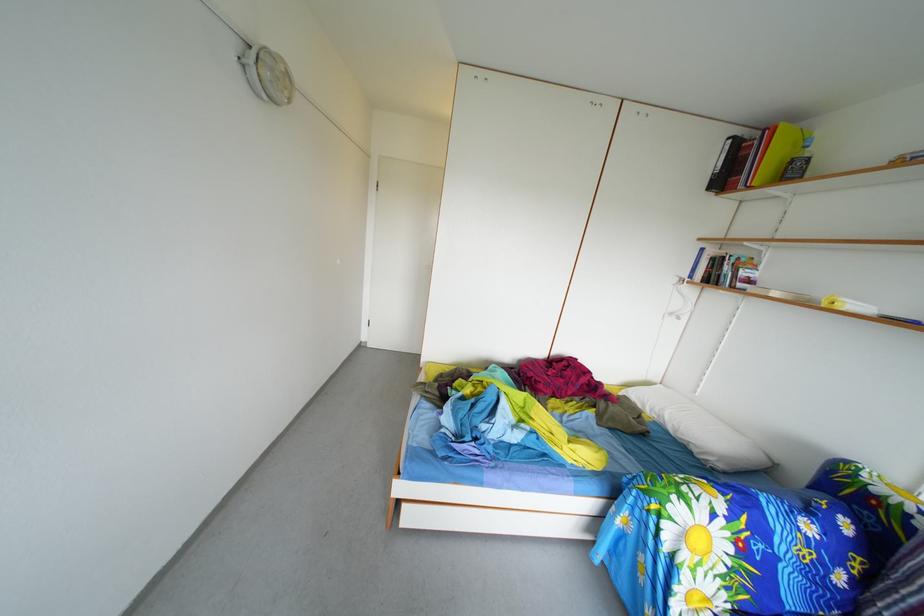
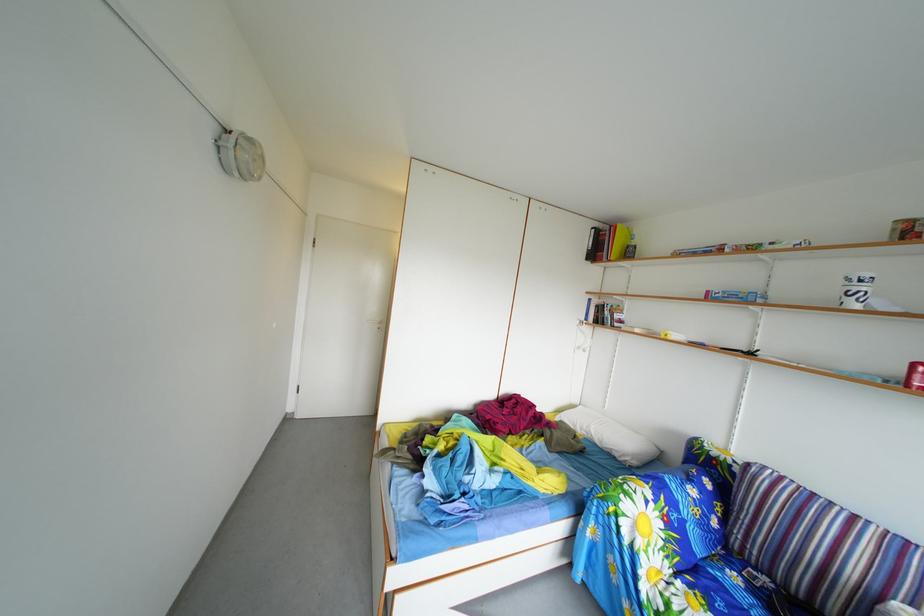
What movement of the cameraman would produce the second image?

The movement direction of the cameraman is left, backward.